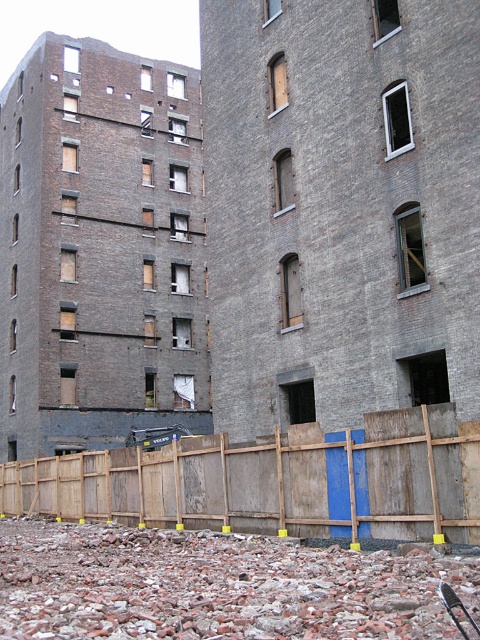
You are a construction worker standing at the wooden fence at lower center. You need to inspect the dark gray brick building at left. Which direction should you look to see the building?

You should look upward because the dark gray brick building at left is above the wooden fence at lower center.

In the scene shown: You are a construction worker who needs to transport materials from the rusty gravel pile at lower center to the dark gray brick building at left. Given the size difference between them, which object will require more space to accommodate the materials?

The dark gray brick building at left is larger in size than the rusty gravel pile at lower center, so it will require more space to accommodate the materials.

You are a construction worker standing at the base of the dark gray brick building at left. Your supervisor asks you to walk to the nearest emergency exit, which is located at the base of the building. Considering the distance between you and the building, can you safely reach the emergency exit without needing to cross any obstacles?

The distance between you and the dark gray brick building at left is 45.72 meters. Since the emergency exit is at the base of the building, you would need to walk 45.72 meters to reach it. This distance might be challenging without obstacles, but since no obstacles are mentioned, you can safely reach the emergency exit.